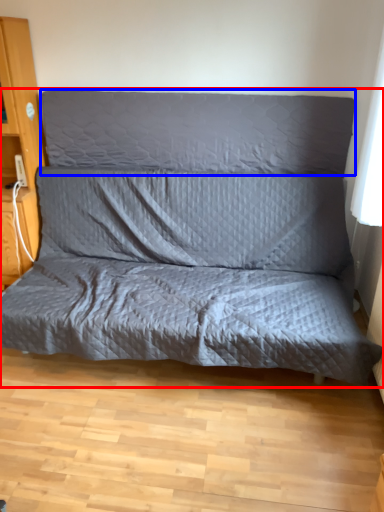
Question: Which point is further to the camera, studio couch (highlighted by a red box) or pillow (highlighted by a blue box)?

Choices:
 (A) studio couch
 (B) pillow

Answer: (B)